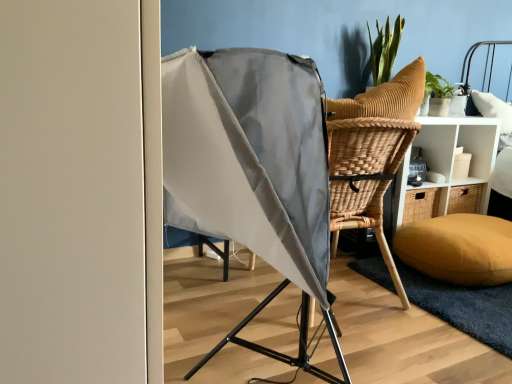
Question: From the image's perspective, is mustard yellow fabric pillow at lower right located above soft yellow mat at lower right?

Choices:
 (A) no
 (B) yes

Answer: (B)

Question: Is mustard yellow fabric pillow at lower right bigger than soft yellow mat at lower right?

Choices:
 (A) no
 (B) yes

Answer: (B)

Question: Is the position of mustard yellow fabric pillow at lower right less distant than that of soft yellow mat at lower right?

Choices:
 (A) yes
 (B) no

Answer: (B)

Question: From the image's perspective, is mustard yellow fabric pillow at lower right below soft yellow mat at lower right?

Choices:
 (A) no
 (B) yes

Answer: (A)

Question: From a real-world perspective, is mustard yellow fabric pillow at lower right physically below soft yellow mat at lower right?

Choices:
 (A) yes
 (B) no

Answer: (B)

Question: Can you confirm if mustard yellow fabric pillow at lower right is shorter than soft yellow mat at lower right?

Choices:
 (A) no
 (B) yes

Answer: (A)

Question: Does mustard yellow fabric pillow at lower right come behind brown wicker chair at center right?

Choices:
 (A) yes
 (B) no

Answer: (B)

Question: From a real-world perspective, is mustard yellow fabric pillow at lower right on brown wicker chair at center right?

Choices:
 (A) yes
 (B) no

Answer: (B)

Question: Is mustard yellow fabric pillow at lower right directly adjacent to brown wicker chair at center right?

Choices:
 (A) no
 (B) yes

Answer: (A)

Question: Is mustard yellow fabric pillow at lower right bigger than brown wicker chair at center right?

Choices:
 (A) no
 (B) yes

Answer: (A)

Question: Is mustard yellow fabric pillow at lower right positioned in front of brown wicker chair at center right?

Choices:
 (A) no
 (B) yes

Answer: (B)

Question: Is brown wicker chair at center right at the back of mustard yellow fabric pillow at lower right?

Choices:
 (A) no
 (B) yes

Answer: (A)

Question: Are soft yellow mat at lower right and brown wicker chair at center right far apart?

Choices:
 (A) yes
 (B) no

Answer: (B)